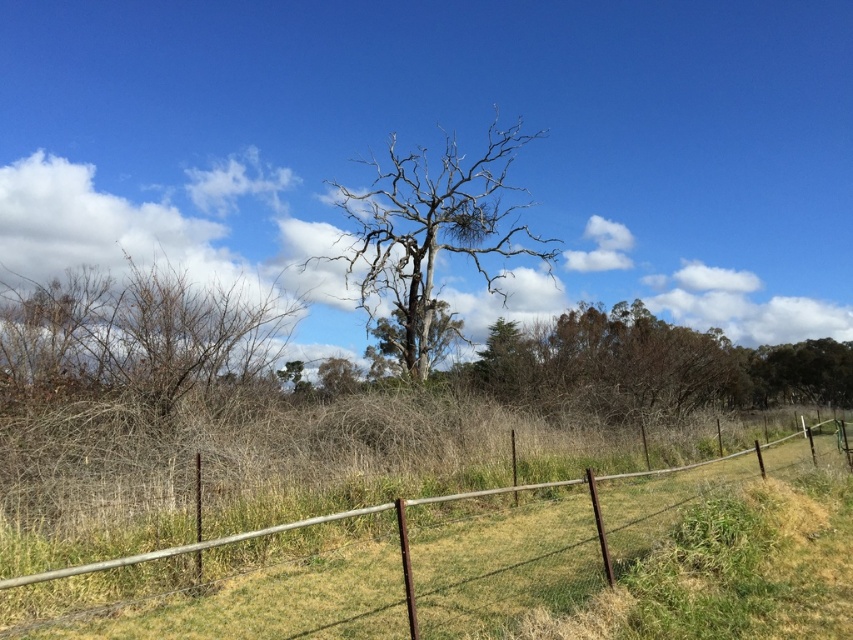
Between green leafy tree at right and gray bark tree at center, which one is positioned higher?

gray bark tree at center is above.

Between point (827, 388) and point (402, 326), which one is positioned in front?

Point (402, 326) is more forward.

Which is behind, point (831, 339) or point (409, 326)?

Point (831, 339)

The width and height of the screenshot is (853, 640). Find the location of `green leafy tree at right`. green leafy tree at right is located at coordinates tap(802, 372).

Does brown wire fence at center appear on the right side of bare wood tree at center?

Indeed, brown wire fence at center is positioned on the right side of bare wood tree at center.

Between point (512, 516) and point (384, 252), which one is positioned in front?

Point (512, 516)

Find the location of a particular element. Image resolution: width=853 pixels, height=640 pixels. brown wire fence at center is located at coordinates (273, 595).

Between brown wire fence at center and brown dry bush at left, which one appears on the right side from the viewer's perspective?

brown wire fence at center is more to the right.

Image resolution: width=853 pixels, height=640 pixels. What do you see at coordinates (273, 595) in the screenshot? I see `brown wire fence at center` at bounding box center [273, 595].

Where is `brown wire fence at center`? brown wire fence at center is located at coordinates (273, 595).